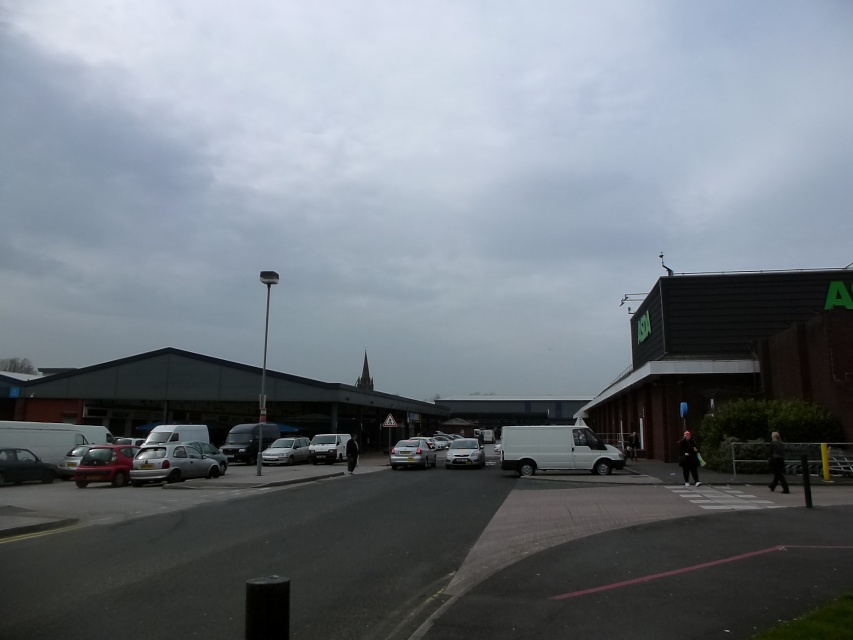
The width and height of the screenshot is (853, 640). Describe the element at coordinates (286, 451) in the screenshot. I see `satin silver van at center` at that location.

Looking at this image, who is positioned more to the left, satin silver van at center or silver metallic hatchback at lower left?

→ silver metallic hatchback at lower left is more to the left.

Between point (299, 436) and point (207, 456), which one is positioned in front?

Positioned in front is point (207, 456).

Identify the location of satin silver van at center. (286, 451).

Between satin silver van at center and silver metallic car at center, which one appears on the right side from the viewer's perspective?

silver metallic car at center

Who is shorter, satin silver van at center or silver metallic car at center?

satin silver van at center

Where is `satin silver van at center`? The width and height of the screenshot is (853, 640). satin silver van at center is located at coordinates (286, 451).

Between metallic silver cars at center and satin silver van at center, which one appears on the left side from the viewer's perspective?

satin silver van at center

Measure the distance between metallic silver cars at center and satin silver van at center.

74.65 feet

I want to click on metallic silver cars at center, so click(x=442, y=561).

Locate an element on the screen. The width and height of the screenshot is (853, 640). metallic silver cars at center is located at coordinates (442, 561).